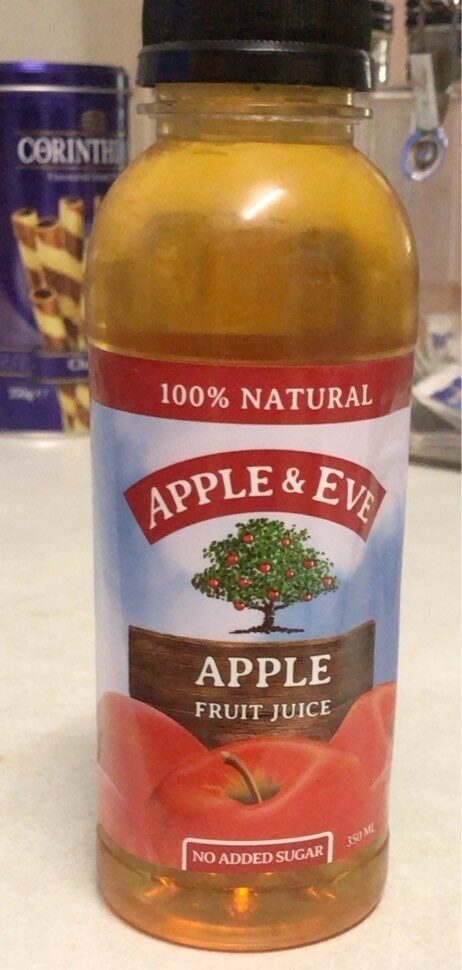
Identify the location of surface. This screenshot has height=970, width=462. (39, 734), (436, 932).